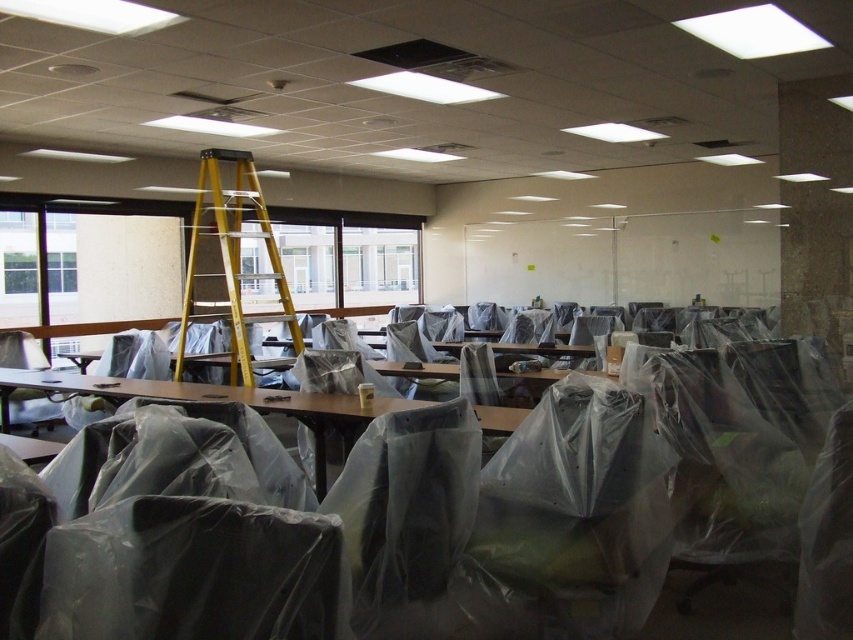
Consider the image. You are a worker in the room and need to move the clear plastic table at center to another location. Can you move it without first moving the yellow fiberglass ladder at upper center?

The yellow fiberglass ladder at upper center is located above the clear plastic table at center, so you would need to move the ladder first before moving the table to avoid obstruction.